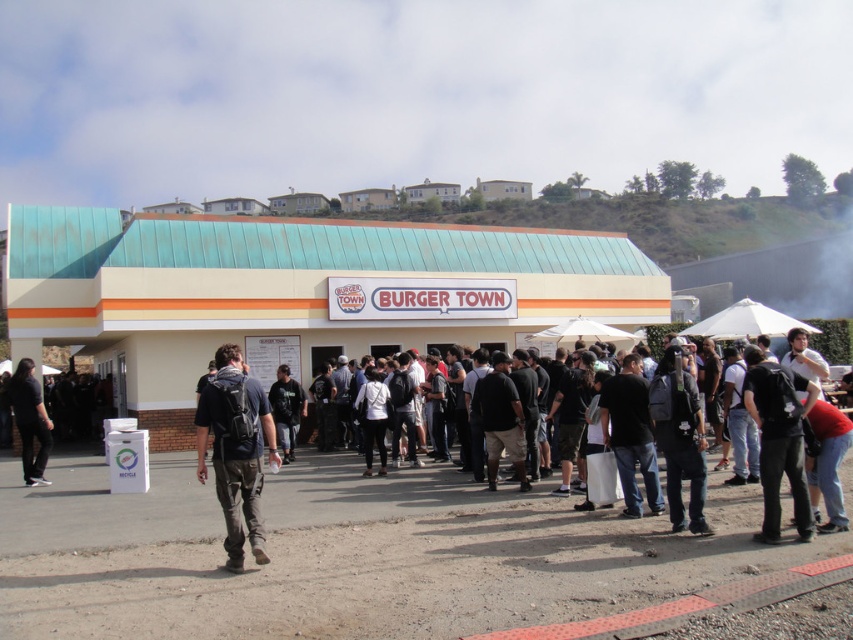
Can you confirm if black backpack at center is shorter than dark gray fabric shirt at center?

Yes, black backpack at center is shorter than dark gray fabric shirt at center.

What do you see at coordinates (778, 438) in the screenshot?
I see `black backpack at center` at bounding box center [778, 438].

The height and width of the screenshot is (640, 853). What do you see at coordinates (778, 438) in the screenshot?
I see `black backpack at center` at bounding box center [778, 438].

Where is `black backpack at center`? The image size is (853, 640). black backpack at center is located at coordinates (778, 438).

Which is more to the right, dark blue t-shirt at center or dark blue jeans at center?

dark blue jeans at center is more to the right.

Can you confirm if dark blue t-shirt at center is smaller than dark blue jeans at center?

Actually, dark blue t-shirt at center might be larger than dark blue jeans at center.

Is point (196, 420) positioned before point (677, 461)?

No, it is behind (677, 461).

The image size is (853, 640). Identify the location of dark blue t-shirt at center. (235, 449).

Is black matte shirt at center positioned behind dark gray hoodie at center?

No, it is not.

Is black matte shirt at center taller than dark gray hoodie at center?

Yes.

At what (x,y) coordinates should I click in order to perform the action: click on black matte shirt at center. Please return your answer as a coordinate pair (x, y). The height and width of the screenshot is (640, 853). Looking at the image, I should click on (630, 435).

The image size is (853, 640). I want to click on black matte shirt at center, so click(630, 435).